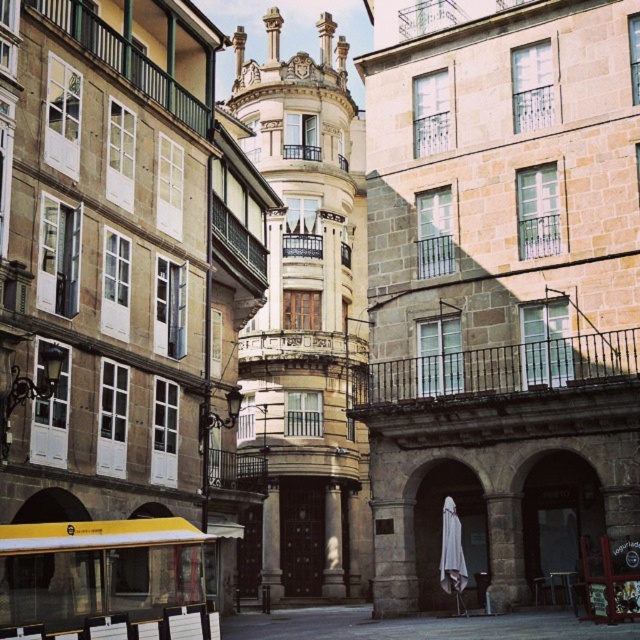
Question: Does white cotton robe at center have a smaller size compared to gold metallic clock at upper center?

Choices:
 (A) yes
 (B) no

Answer: (A)

Question: Which point is closer to the camera?

Choices:
 (A) (449, 500)
 (B) (301, 76)

Answer: (A)

Question: Is white cotton robe at center to the left of gold metallic clock at upper center from the viewer's perspective?

Choices:
 (A) no
 (B) yes

Answer: (A)

Question: Can you confirm if white cotton robe at center is positioned to the left of gold metallic clock at upper center?

Choices:
 (A) no
 (B) yes

Answer: (A)

Question: Which object appears farthest from the camera in this image?

Choices:
 (A) gold metallic clock at upper center
 (B) white cotton robe at center

Answer: (A)

Question: Which object appears closest to the camera in this image?

Choices:
 (A) white cotton robe at center
 (B) gold metallic clock at upper center

Answer: (A)